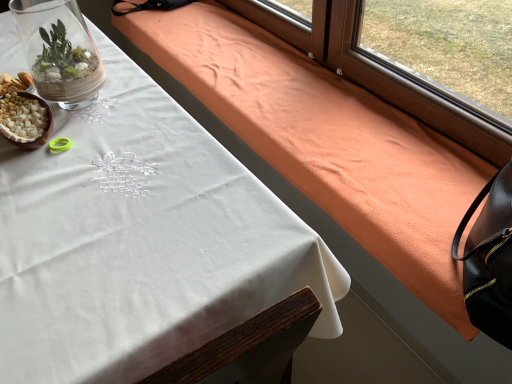
Question: Is orange suede blanket at upper right not close to white matte bowl at lower left?

Choices:
 (A) no
 (B) yes

Answer: (A)

Question: Is orange suede blanket at upper right to the right of white matte bowl at lower left from the viewer's perspective?

Choices:
 (A) no
 (B) yes

Answer: (B)

Question: Can we say orange suede blanket at upper right lies outside white matte bowl at lower left?

Choices:
 (A) no
 (B) yes

Answer: (B)

Question: From a real-world perspective, is orange suede blanket at upper right below white matte bowl at lower left?

Choices:
 (A) no
 (B) yes

Answer: (B)

Question: Is orange suede blanket at upper right bigger than white matte bowl at lower left?

Choices:
 (A) no
 (B) yes

Answer: (B)

Question: From the image's perspective, is orange suede blanket at upper right under white matte bowl at lower left?

Choices:
 (A) no
 (B) yes

Answer: (A)

Question: Is white cloth at upper left directly adjacent to orange suede blanket at upper right?

Choices:
 (A) no
 (B) yes

Answer: (A)

Question: Is white cloth at upper left turned away from orange suede blanket at upper right?

Choices:
 (A) yes
 (B) no

Answer: (A)

Question: Is white cloth at upper left taller than orange suede blanket at upper right?

Choices:
 (A) no
 (B) yes

Answer: (B)

Question: From the image's perspective, is white cloth at upper left above orange suede blanket at upper right?

Choices:
 (A) yes
 (B) no

Answer: (B)

Question: Can you confirm if white cloth at upper left is smaller than orange suede blanket at upper right?

Choices:
 (A) yes
 (B) no

Answer: (B)

Question: Does white cloth at upper left come behind orange suede blanket at upper right?

Choices:
 (A) yes
 (B) no

Answer: (B)

Question: Considering the relative sizes of white matte bowl at lower left and white cloth at upper left in the image provided, is white matte bowl at lower left bigger than white cloth at upper left?

Choices:
 (A) no
 (B) yes

Answer: (A)